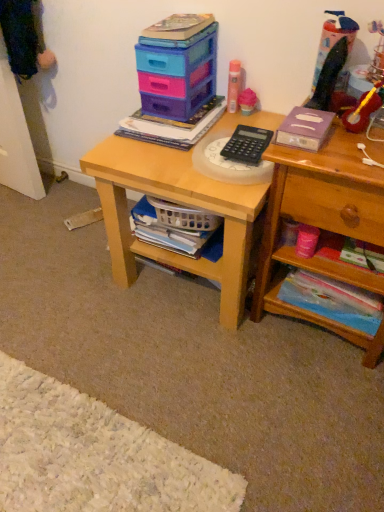
What are the coordinates of `free space behind black plastic calculator at center` in the screenshot? It's located at (245, 120).